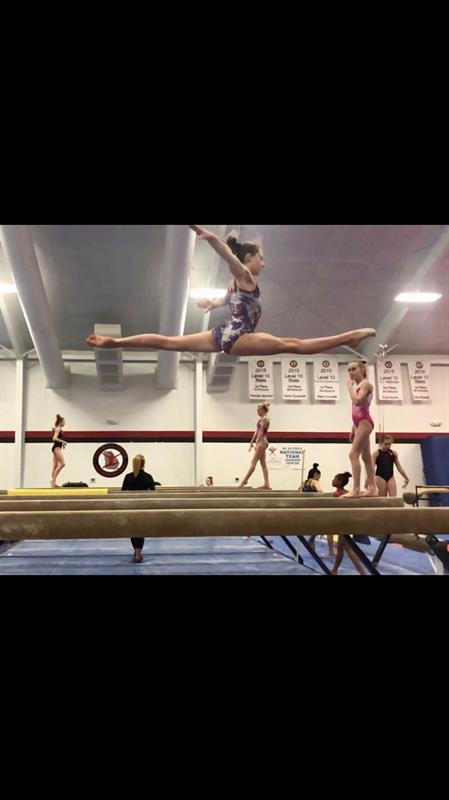
Locate an element on the screen. The width and height of the screenshot is (449, 800). banners on wall is located at coordinates (259, 386), (295, 370), (325, 377), (389, 374), (425, 377), (289, 458).